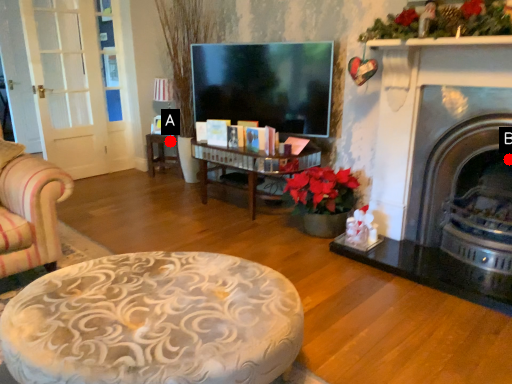
Question: Two points are circled on the image, labeled by A and B beside each circle. Which point appears closest to the camera in this image?

Choices:
 (A) A is closer
 (B) B is closer

Answer: (B)